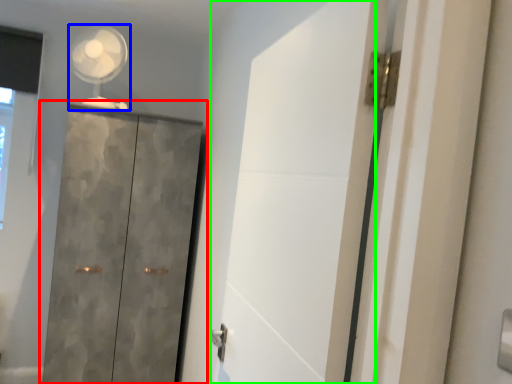
Question: Which object is the closest to the cupboard (highlighted by a red box)? Choose among these: mechanical fan (highlighted by a blue box) or screen door (highlighted by a green box).

Choices:
 (A) mechanical fan
 (B) screen door

Answer: (A)